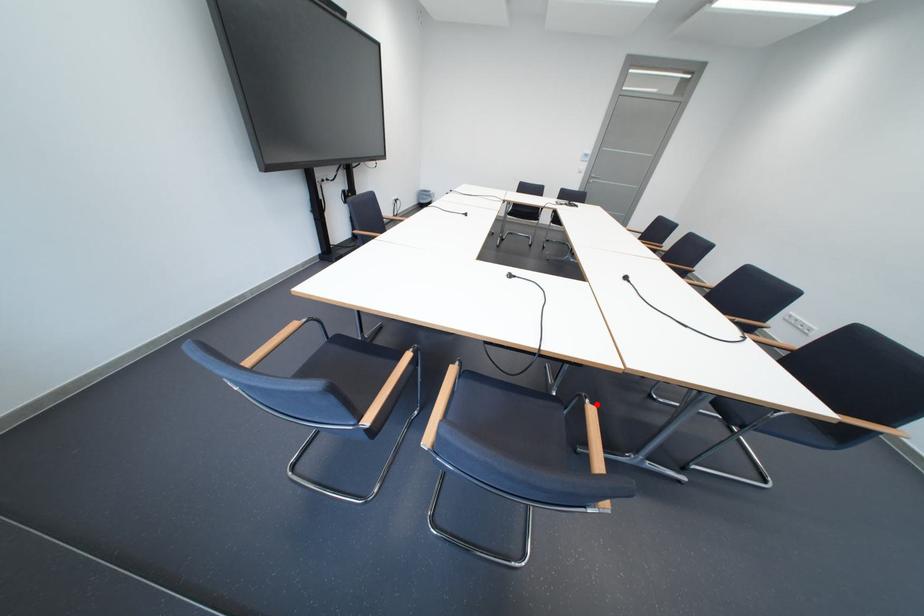
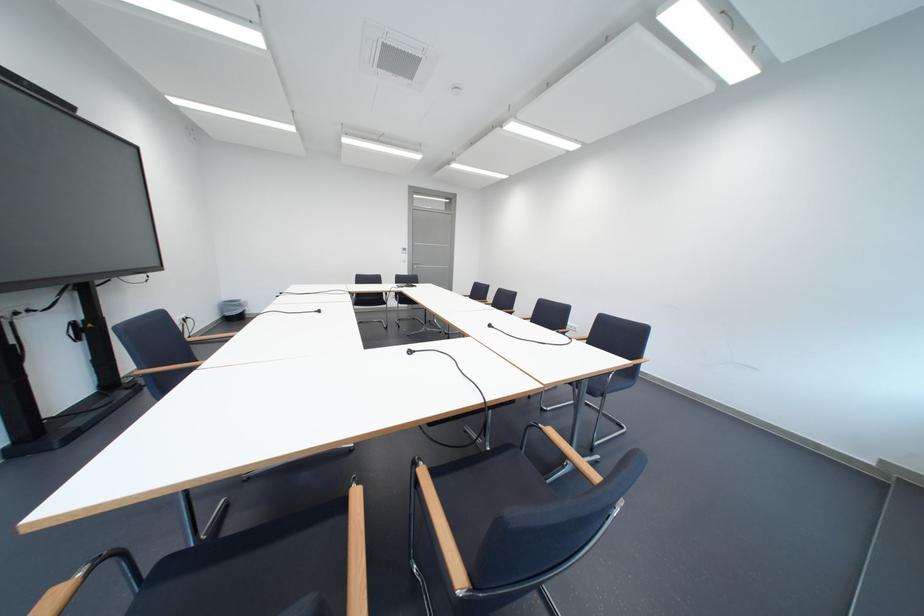
The point at the highlighted location is marked in the first image. Where is the corresponding point in the second image?

(553, 431)